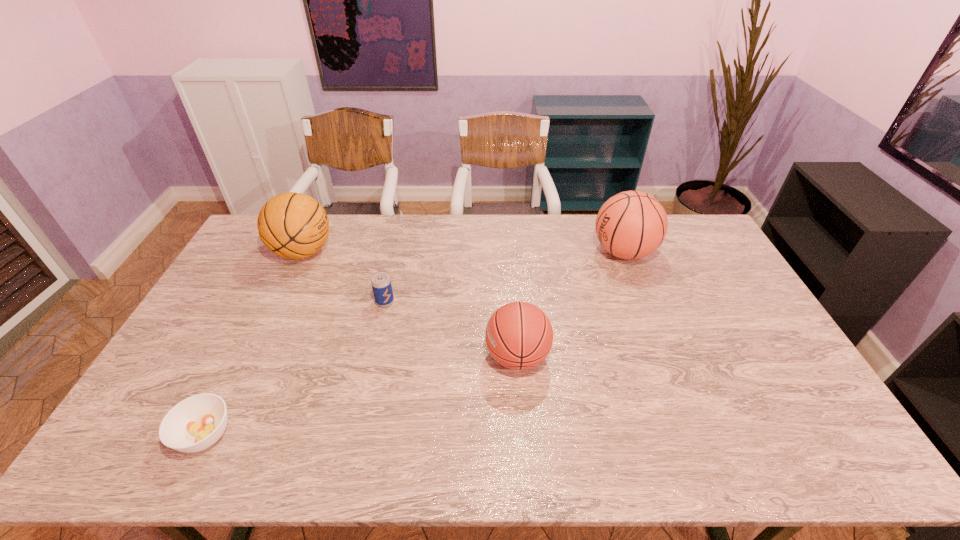
This screenshot has width=960, height=540. In order to click on object situated at the far left corner in this screenshot , I will do `click(293, 225)`.

Locate an element on the screen. object positioned at the near left corner is located at coordinates (196, 423).

Image resolution: width=960 pixels, height=540 pixels. I want to click on free region at the far edge of the desktop, so click(372, 214).

I want to click on free space at the near edge, so click(263, 467).

This screenshot has height=540, width=960. Find the location of `free space at the left edge of the desktop`. free space at the left edge of the desktop is located at coordinates (263, 293).

I want to click on vacant point at the right edge, so click(727, 311).

I want to click on vacant space at the far right corner of the desktop, so click(x=677, y=253).

At what (x,y) coordinates should I click in order to perform the action: click on empty space between the nearest object and the rightmost basketball. Please return your answer as a coordinate pair (x, y). The width and height of the screenshot is (960, 540). Looking at the image, I should click on (415, 343).

Where is `free point between the leftmost basketball and the third object from right to left`? The height and width of the screenshot is (540, 960). free point between the leftmost basketball and the third object from right to left is located at coordinates (344, 277).

Find the location of a particular element. free space between the nearest object and the second shortest object is located at coordinates (295, 368).